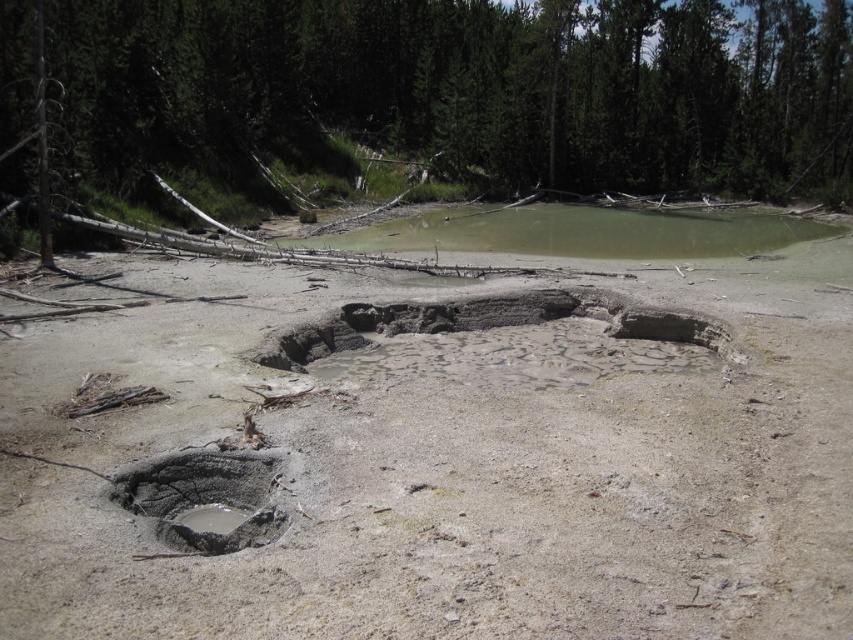
Is green leafy tree at upper center positioned in front of muddy water at center?

Yes.

Does point (643, 150) lie in front of point (489, 244)?

No, (643, 150) is behind (489, 244).

Is point (712, 19) positioned before point (637, 259)?

No, it is not.

I want to click on green leafy tree at upper center, so (x=444, y=100).

Image resolution: width=853 pixels, height=640 pixels. Describe the element at coordinates (444, 100) in the screenshot. I see `green leafy tree at upper center` at that location.

Who is more forward, (9, 148) or (142, 508)?

Positioned in front is point (142, 508).

Is point (405, 76) more distant than point (221, 460)?

Yes, it is.

The height and width of the screenshot is (640, 853). In order to click on green leafy tree at upper center in this screenshot , I will do `click(444, 100)`.

The height and width of the screenshot is (640, 853). What do you see at coordinates (582, 230) in the screenshot?
I see `muddy water at center` at bounding box center [582, 230].

Locate an element on the screen. muddy water at center is located at coordinates (582, 230).